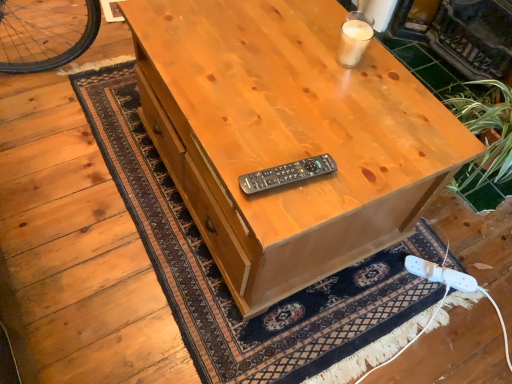
Image resolution: width=512 pixels, height=384 pixels. I want to click on vacant space behind black plastic remote at center, so click(292, 124).